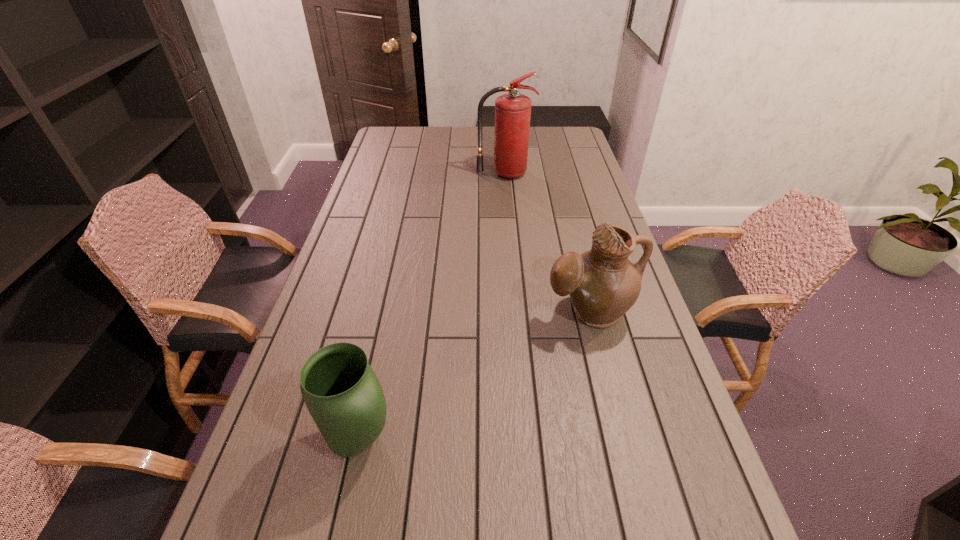
Locate an element on the screen. This screenshot has width=960, height=540. vacant region at the left edge of the desktop is located at coordinates (348, 305).

Identify the location of free location at the right edge. The image size is (960, 540). (642, 426).

Locate an element on the screen. Image resolution: width=960 pixels, height=540 pixels. free location at the far right corner of the desktop is located at coordinates (564, 127).

Locate an element on the screen. vacant area between the pitcher and the tallest object is located at coordinates (547, 242).

Locate an element on the screen. This screenshot has height=540, width=960. free space between the fire extinguisher and the vase is located at coordinates (432, 307).

At what (x,y) coordinates should I click in order to perform the action: click on vacant space in between the leftmost object and the fire extinguisher. Please return your answer as a coordinate pair (x, y). This screenshot has height=540, width=960. Looking at the image, I should click on (432, 307).

Locate an element on the screen. empty space that is in between the shortest object and the second farthest object is located at coordinates (474, 376).

I want to click on empty space between the second farthest object and the leftmost object, so coord(474,376).

This screenshot has height=540, width=960. Find the location of `free space between the leftmost object and the farthest object`. free space between the leftmost object and the farthest object is located at coordinates (432, 307).

Select which object is the closest to the vase. Please provide its 2D coordinates. Your answer should be formatted as a tuple, i.e. [(x, y)], where the tuple contains the x and y coordinates of a point satisfying the conditions above.

[(603, 284)]